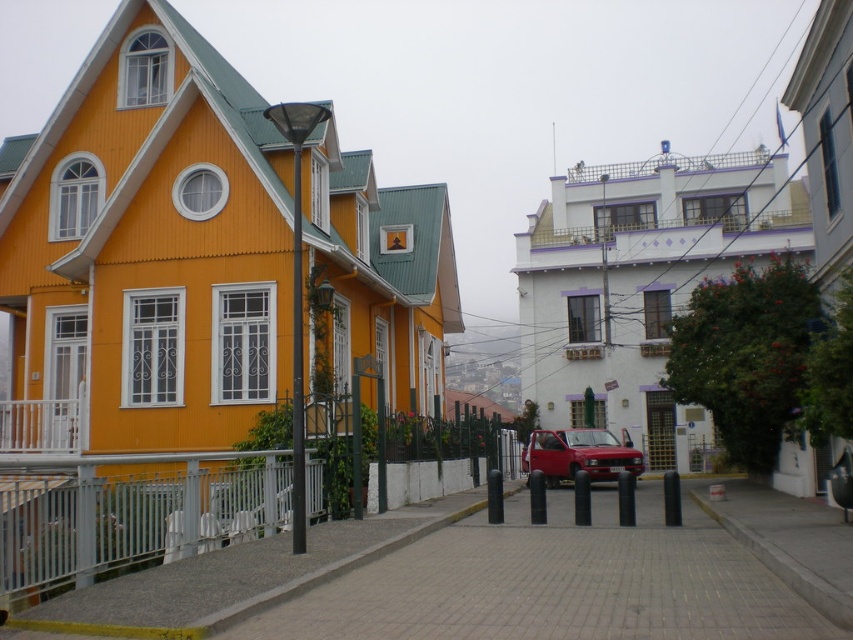
You are standing in the middle of the street looking at the two buildings. You notice two points marked in the image. One is at coordinate point (10, 548) and the other is at point (543, 448). Which point is closer to you?

Point (10, 548) is closer to the viewer than point (543, 448).

You are a pedestrian standing on the sidewalk and want to cross the street to reach the white building with purple accents. There is a matte red car at center blocking the path. Can you safely walk around the car to the left side to get to the building? Consider the white painted metal railing at lower left in your path.

The white painted metal railing at lower left is to the left of the matte red car at center, so you can walk around the car to the left side. However, you need to ensure there is enough space between the car and the railing to pass safely.